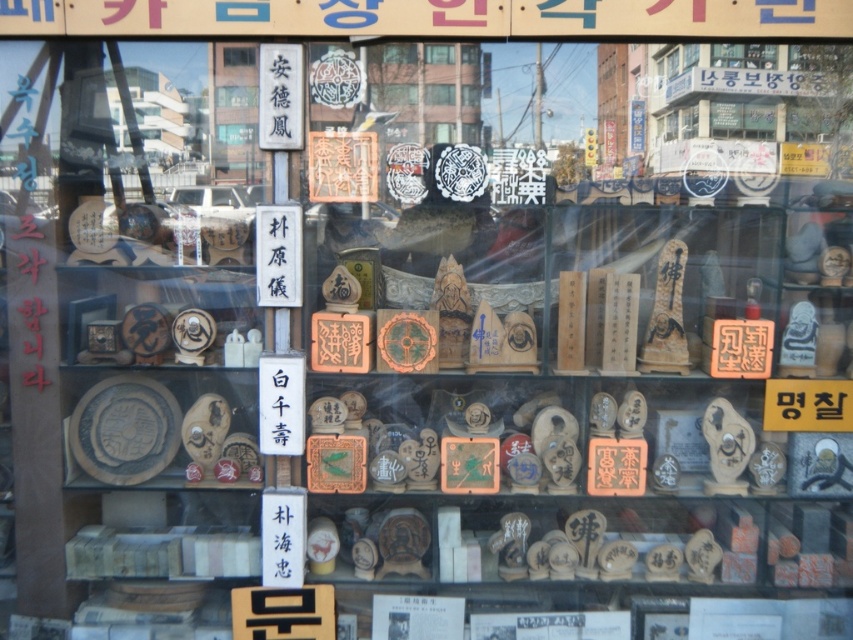
How much distance is there between transparent glass window at center and wooden plaque at center?

19.93 inches

Is transparent glass window at center bigger than wooden plaque at center?

Yes.

This screenshot has height=640, width=853. What do you see at coordinates (239, 54) in the screenshot?
I see `transparent glass window at center` at bounding box center [239, 54].

The height and width of the screenshot is (640, 853). I want to click on transparent glass window at center, so pos(239,54).